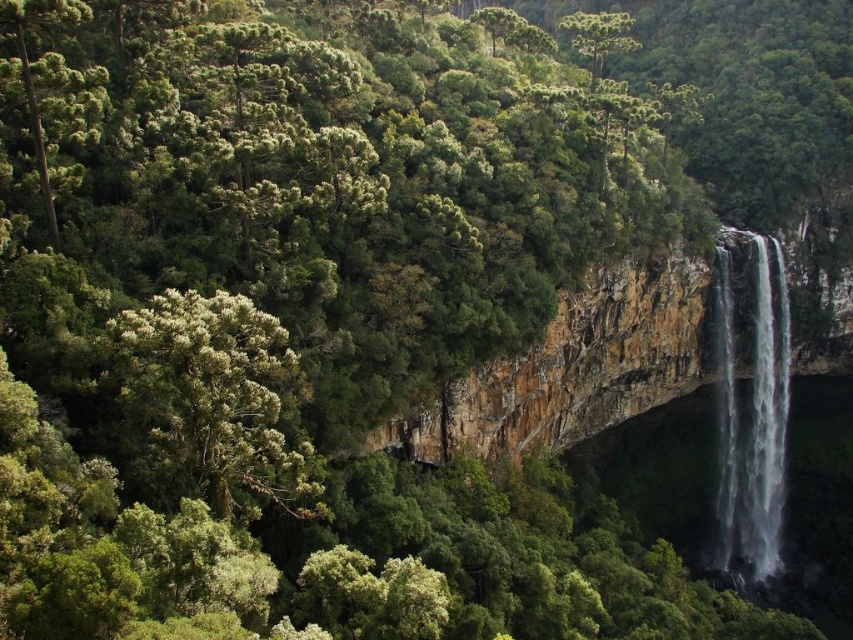
You are planning to set up a small campsite in this forest. You need to choose between placing your tent under the green leafy tree at left or near the clear water at right. Considering the space available, which location offers more horizontal space for your tent?

The clear water at right offers more horizontal space because its width is greater than the green leafy tree at left.

You are a hiker who wants to take a photo of the clear water at right while standing near the green leafy tree at left. Considering their sizes, which object should you focus on to ensure both are visible in the frame?

The green leafy tree at left is smaller than the clear water at right. To ensure both are visible in the frame, focus on the smaller object, which is the green leafy tree at left, and adjust the camera angle to include the larger clear water at right.